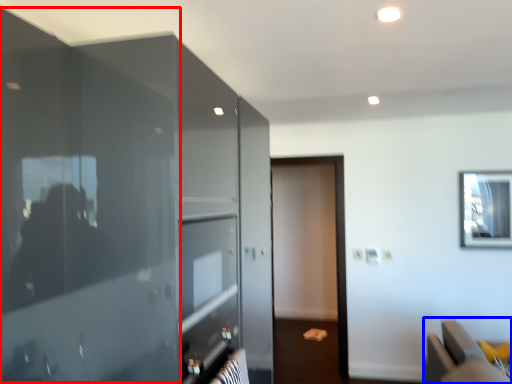
Question: Which object is further to the camera taking this photo, glass door (highlighted by a red box) or furniture (highlighted by a blue box)?

Choices:
 (A) glass door
 (B) furniture

Answer: (B)